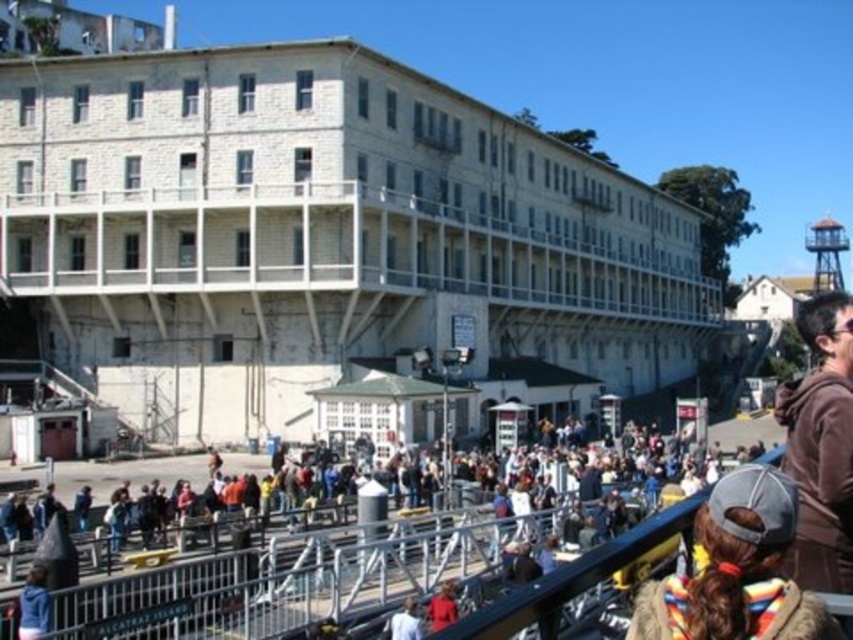
You are a photographer standing at the entrance of the building and want to capture a photo of the multicolored fur coat at lower right. According to the coordinates provided, where should you position your camera to ensure the coat is centered in the frame?

The multicolored fur coat at lower right is located at coordinates point (737, 570), so you should position your camera to center the frame on that point to capture the coat.

You are a photographer standing in the crowd in front of the building. You need to take a photo of the building but there are two jackets blocking your view. Can you see the building through the gap between the multicolored fur coat at lower right and the brown fuzzy jacket at right?

The multicolored fur coat at lower right is below the brown fuzzy jacket at right, so there is a gap between them. You can see the building through the gap between the multicolored fur coat at lower right and the brown fuzzy jacket at right.